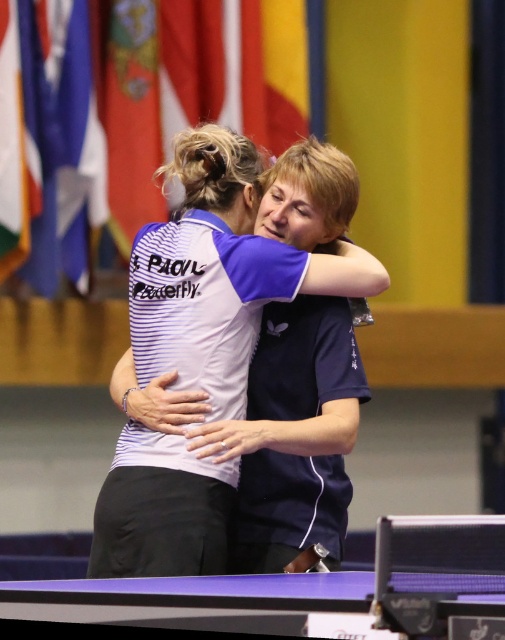
Does white striped shirt at center appear over purple glossy table tennis table at lower center?

Yes, white striped shirt at center is above purple glossy table tennis table at lower center.

Is point (323, 163) positioned in front of point (194, 592)?

No.

Is point (179, 477) more distant than point (447, 605)?

That is True.

Locate an element on the screen. This screenshot has height=640, width=505. white striped shirt at center is located at coordinates (229, 339).